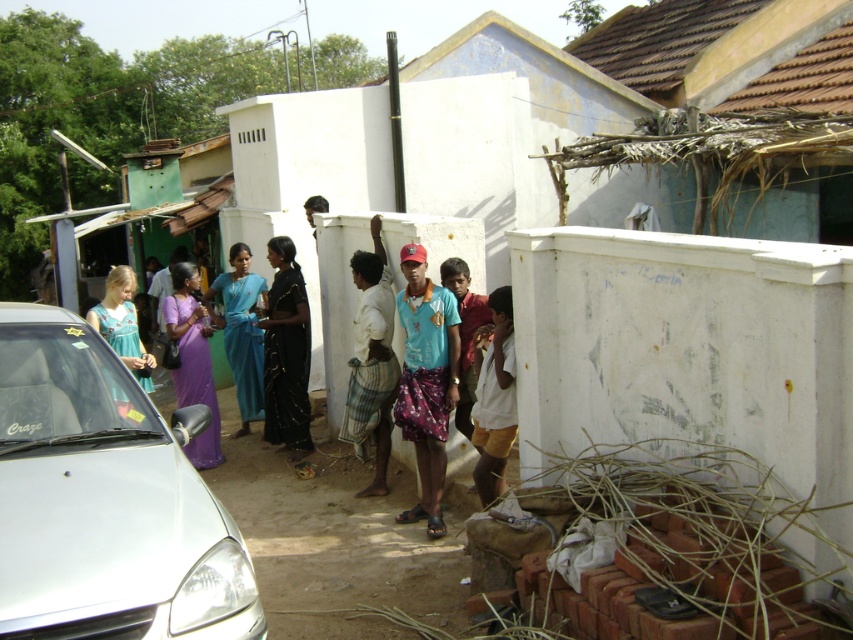
Who is taller, matte blue shirt at center or light blue fabric dress at center?

matte blue shirt at center is taller.

Is point (442, 417) closer to viewer compared to point (151, 364)?

Yes.

Does point (415, 388) come behind point (122, 344)?

No, (415, 388) is closer to viewer.

You are a GUI agent. You are given a task and a screenshot of the screen. Output one action in this format:
    pyautogui.click(x=<x>, y=<y>)
    Task: Click on the matte blue shirt at center
    Image resolution: width=853 pixels, height=640 pixels.
    Given the screenshot: What is the action you would take?
    pyautogui.click(x=426, y=380)

Can you confirm if white cotton shirt at center is positioned to the right of light blue fabric dress at center?

Correct, you'll find white cotton shirt at center to the right of light blue fabric dress at center.

Who is higher up, white cotton shirt at center or light blue fabric dress at center?

light blue fabric dress at center is higher up.

Is point (494, 308) farther from viewer compared to point (136, 349)?

No, it is not.

You are a GUI agent. You are given a task and a screenshot of the screen. Output one action in this format:
    pyautogui.click(x=<x>, y=<y>)
    Task: Click on the white cotton shirt at center
    Image resolution: width=853 pixels, height=640 pixels.
    Given the screenshot: What is the action you would take?
    point(494,397)

Is the position of purple satin saree at center more distant than that of light blue fabric dress at center?

Yes, purple satin saree at center is further from the viewer.

Between purple satin saree at center and light blue fabric dress at center, which one is positioned higher?

light blue fabric dress at center

Between point (189, 316) and point (149, 378), which one is positioned behind?

The point (189, 316) is more distant.

Locate an element on the screen. The image size is (853, 640). purple satin saree at center is located at coordinates (192, 360).